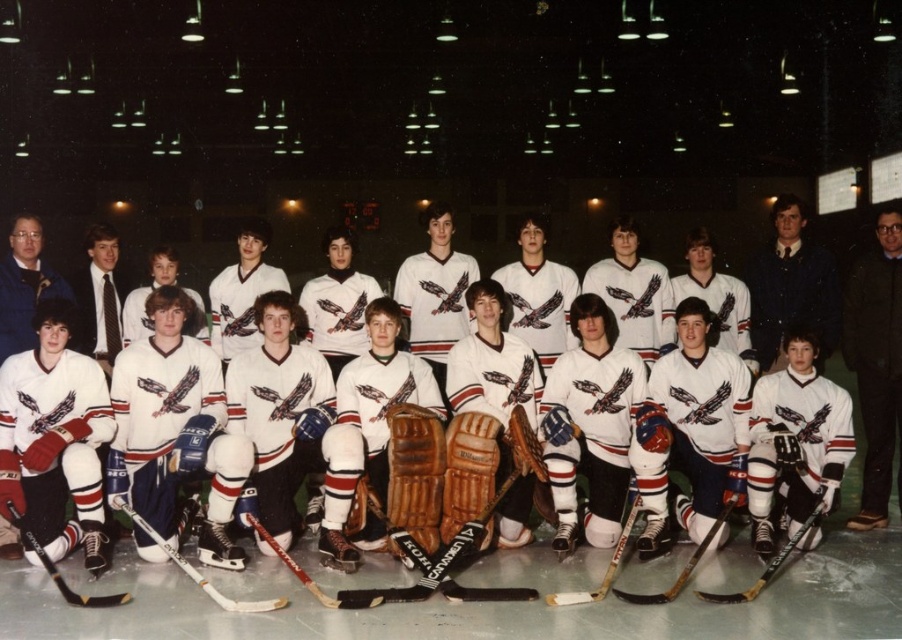
Question: Is dark blue suit at center positioned before brown leather hockey stick at center?

Choices:
 (A) no
 (B) yes

Answer: (A)

Question: Considering the real-world distances, which object is farthest from the black leather jacket at right?

Choices:
 (A) red glossy hockey stick at lower left
 (B) black matte hockey stick at lower center

Answer: (A)

Question: Which is farther from the black rubber hockey stick at lower left?

Choices:
 (A) white matte hockey jerseys at center
 (B) red glossy hockey stick at lower left
 (C) dark blue suit at center
 (D) brown leather hockey stick at center

Answer: (C)

Question: From the image, what is the correct spatial relationship of brown leather hockey stick at center in relation to red glossy hockey stick at lower left?

Choices:
 (A) left
 (B) right

Answer: (B)

Question: Is white matte hockey jerseys at center wider than dark blue suit at center?

Choices:
 (A) no
 (B) yes

Answer: (A)

Question: Which of the following is the closest to the observer?

Choices:
 (A) red glossy hockey stick at lower left
 (B) brown leather hockey stick at center

Answer: (A)